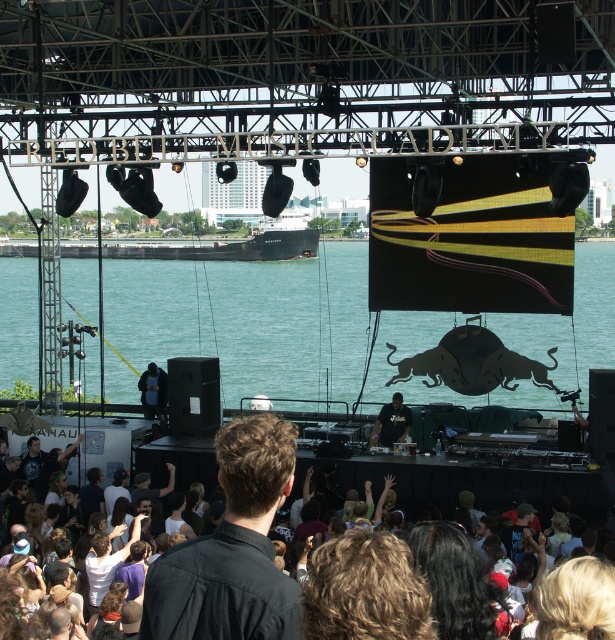
Question: Which point is closer to the camera?

Choices:
 (A) (402, 336)
 (B) (405, 435)
 (C) (153, 400)

Answer: (B)

Question: Among these objects, which one is farthest from the camera?

Choices:
 (A) green water at center
 (B) black matte shirt at center
 (C) dark blue fabric at center

Answer: (C)

Question: Does black matte shirt at center appear on the right side of dark blue fabric at center?

Choices:
 (A) no
 (B) yes

Answer: (B)

Question: Does green water at center appear on the left side of black matte shirt at center?

Choices:
 (A) yes
 (B) no

Answer: (A)

Question: Can you confirm if black matte shirt at center is positioned to the left of dark blue fabric at center?

Choices:
 (A) yes
 (B) no

Answer: (B)

Question: Which of the following is the farthest from the observer?

Choices:
 (A) dark blue fabric at center
 (B) black matte shirt at center

Answer: (A)